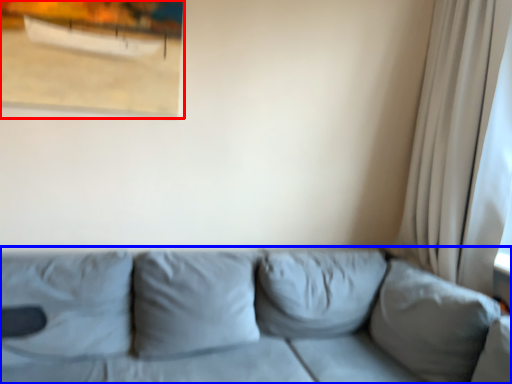
Question: Which object appears closest to the camera in this image, picture frame (highlighted by a red box) or studio couch (highlighted by a blue box)?

Choices:
 (A) picture frame
 (B) studio couch

Answer: (B)